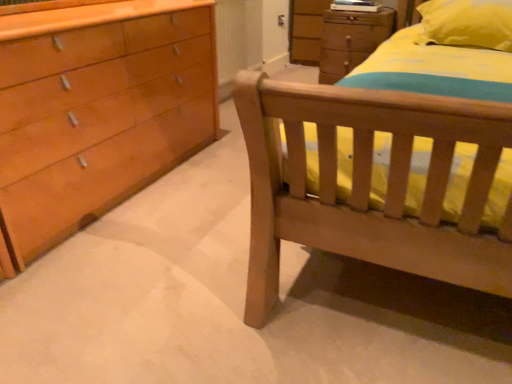
Question: Relative to yellow fabric pillow at upper right, is wooden chest of drawers at upper center in front or behind?

Choices:
 (A) front
 (B) behind

Answer: (B)

Question: Considering the relative positions of wooden chest of drawers at upper center and yellow fabric pillow at upper right in the image provided, is wooden chest of drawers at upper center to the left or to the right of yellow fabric pillow at upper right?

Choices:
 (A) right
 (B) left

Answer: (B)

Question: From a real-world perspective, is wooden chest of drawers at upper center positioned above or below yellow fabric pillow at upper right?

Choices:
 (A) below
 (B) above

Answer: (A)

Question: Is yellow fabric pillow at upper right inside the boundaries of wooden chest of drawers at upper center, or outside?

Choices:
 (A) outside
 (B) inside

Answer: (A)

Question: Based on their positions, is yellow fabric pillow at upper right located to the left or right of wooden chest of drawers at upper center?

Choices:
 (A) right
 (B) left

Answer: (A)

Question: From a real-world perspective, relative to wooden chest of drawers at upper center, is yellow fabric pillow at upper right vertically above or below?

Choices:
 (A) above
 (B) below

Answer: (A)

Question: In terms of width, does yellow fabric pillow at upper right look wider or thinner when compared to wooden chest of drawers at upper center?

Choices:
 (A) thin
 (B) wide

Answer: (B)